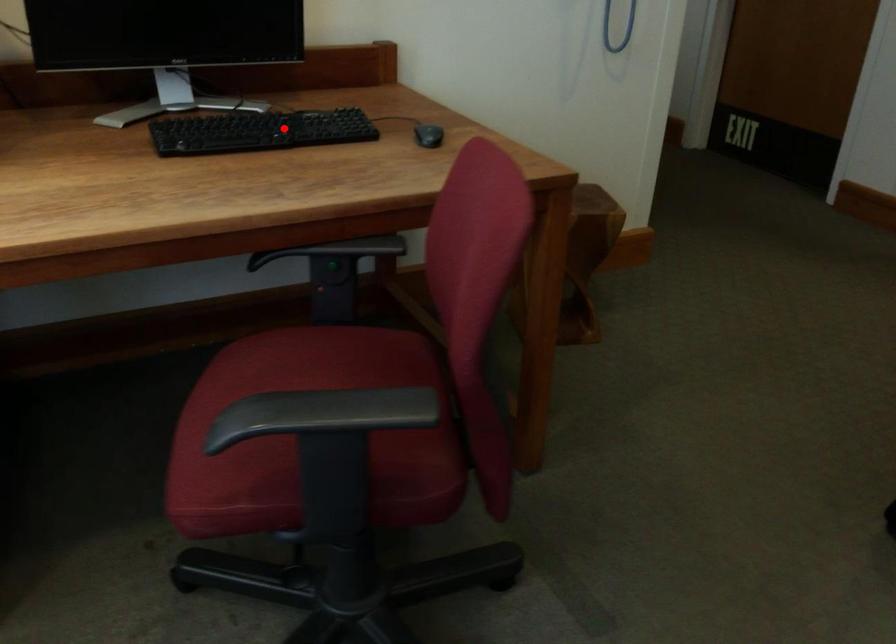
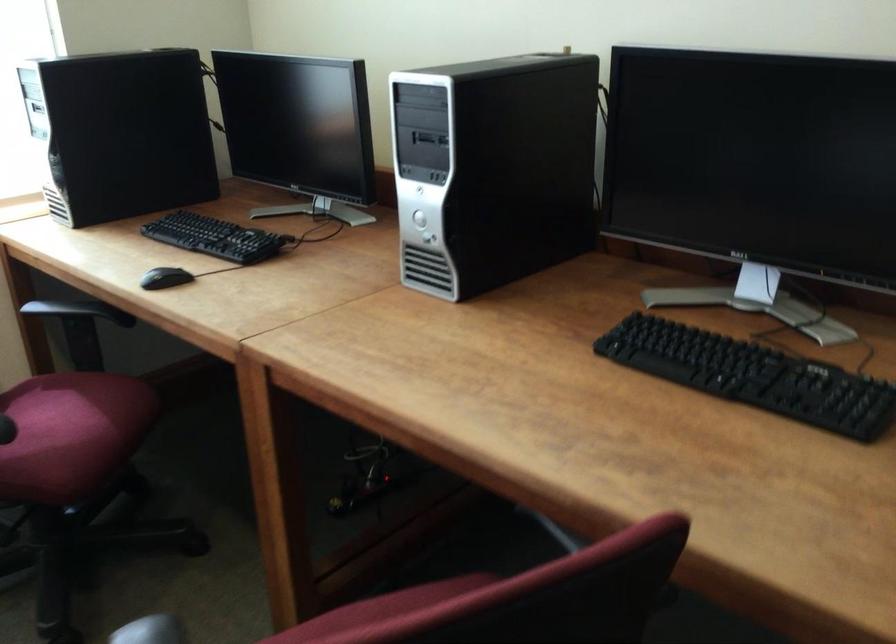
Question: I am providing you with two images of the same scene from different viewpoints. A red point is shown in image1. For the corresponding object point in image2, is it positioned nearer or farther from the camera?

Choices:
 (A) Nearer
 (B) Farther

Answer: (A)